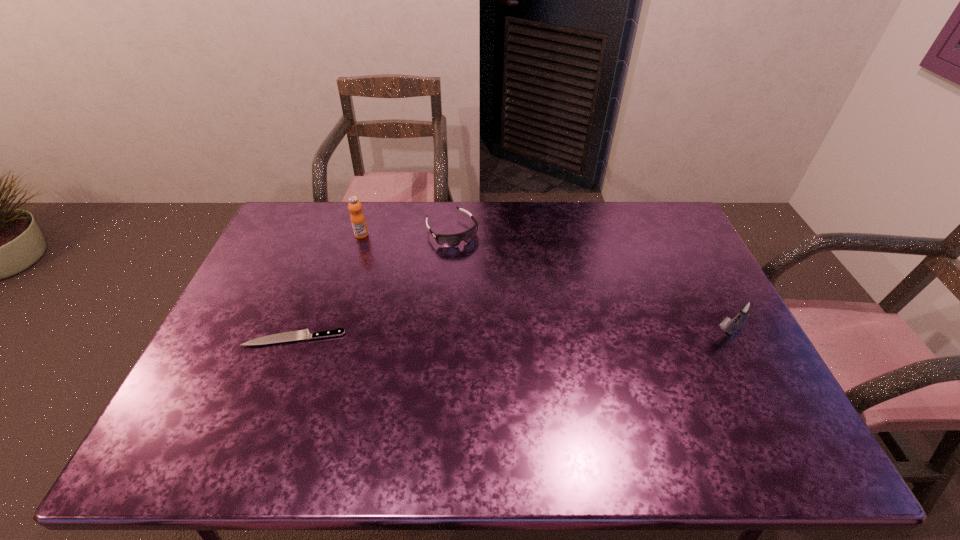
Locate an element on the screen. The height and width of the screenshot is (540, 960). blank space located 0.370m on the front and sides of the goggles is located at coordinates pyautogui.click(x=518, y=321).

Find the location of a particular element. The width and height of the screenshot is (960, 540). vacant space situated on the front label of the tallest object is located at coordinates (413, 274).

Where is `vacant position located on the front label of the tallest object`? The image size is (960, 540). vacant position located on the front label of the tallest object is located at coordinates (417, 277).

What are the coordinates of `vacant region located on the front label of the tallest object` in the screenshot? It's located at (403, 266).

Image resolution: width=960 pixels, height=540 pixels. I want to click on goggles that is at the far edge, so tap(452, 240).

At what (x,y) coordinates should I click in order to perform the action: click on orange juice present at the far edge. Please return your answer as a coordinate pair (x, y). The width and height of the screenshot is (960, 540). Looking at the image, I should click on (357, 218).

The height and width of the screenshot is (540, 960). I want to click on object located at the left edge, so click(x=299, y=334).

At what (x,y) coordinates should I click in order to perform the action: click on object present at the right edge. Please return your answer as a coordinate pair (x, y). Image resolution: width=960 pixels, height=540 pixels. Looking at the image, I should click on (747, 308).

You are a GUI agent. You are given a task and a screenshot of the screen. Output one action in this format:
    pyautogui.click(x=<x>, y=<y>)
    Task: Click on the free space at the far edge
    
    Given the screenshot: What is the action you would take?
    pyautogui.click(x=420, y=201)

In the image, there is a desktop. At what (x,y) coordinates should I click in order to perform the action: click on free space at the near edge. Please return your answer as a coordinate pair (x, y). Looking at the image, I should click on (561, 400).